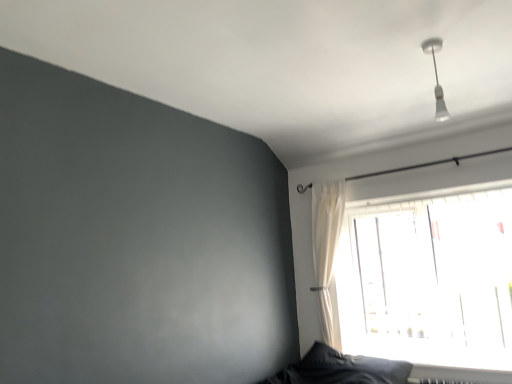
The height and width of the screenshot is (384, 512). Identify the location of free space above white sheer curtain at upper right (from a real-world perspective). (329, 178).